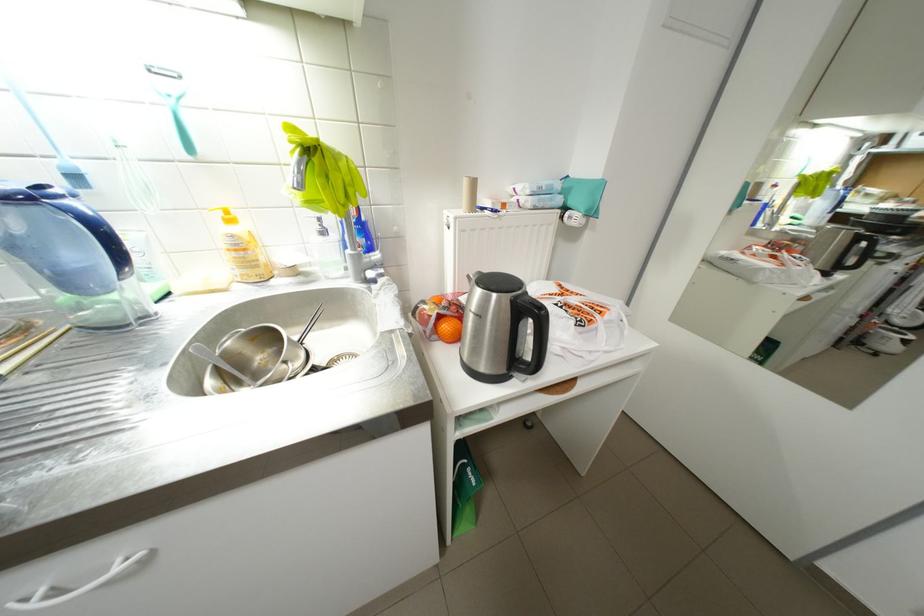
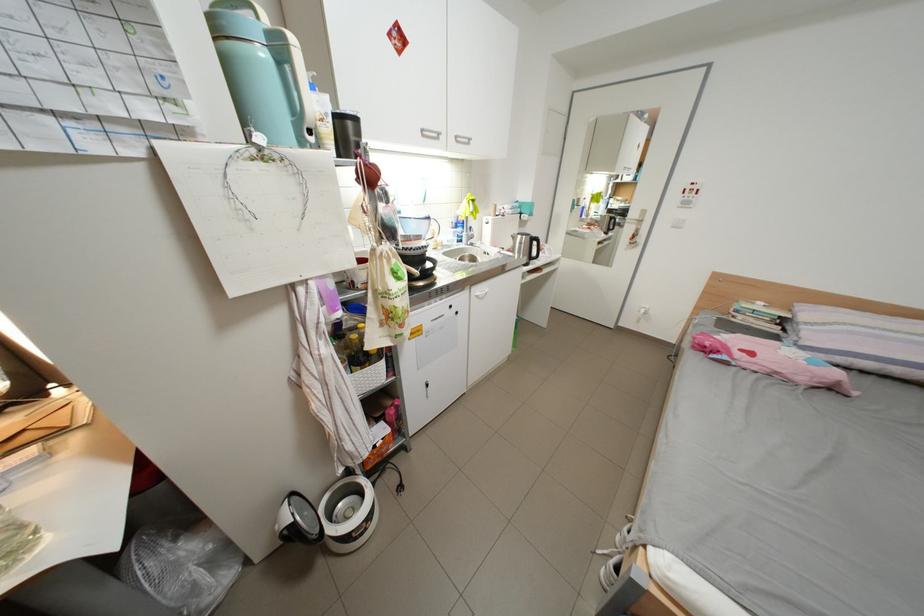
In a continuous first-person perspective shot, in which direction is the camera moving?

The cameraman walked toward left, backward.